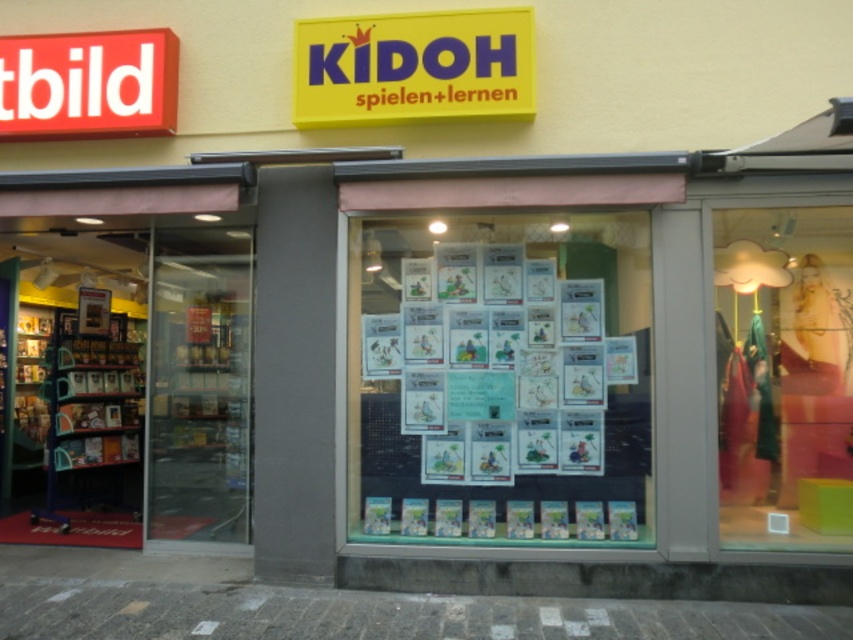
You are a customer entering the store and see the matte pink dress at right and the red plastic sign at upper left. Which object is closer to the entrance?

The matte pink dress at right is closer to the entrance because it is positioned under the red plastic sign at upper left, indicating it is lower in the scene and thus nearer to the viewer.

You are a customer standing outside the store entrance. You want to read both the yellow plastic sign at upper center and the red plastic sign at upper left. Which sign do you think you can read more clearly from your current position?

The yellow plastic sign at upper center might be wider than red plastic sign at upper left, so it could be easier to read from a distance.

You are a customer standing outside the store looking through the glass windows. You notice two items inside the store displayed on the window. The white paper posters at center and the yellow plastic sign at upper center. Which one is wider?

The white paper posters at center is wider than the yellow plastic sign at upper center.